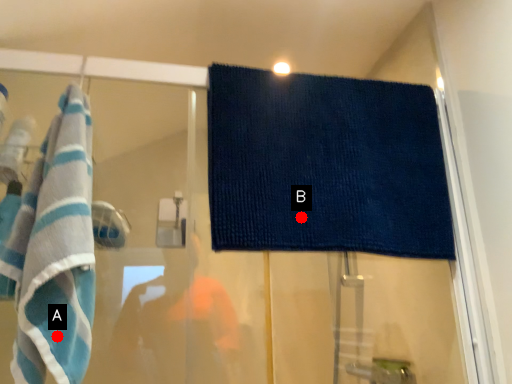
Question: Two points are circled on the image, labeled by A and B beside each circle. Which point is closer to the camera?

Choices:
 (A) A is closer
 (B) B is closer

Answer: (A)